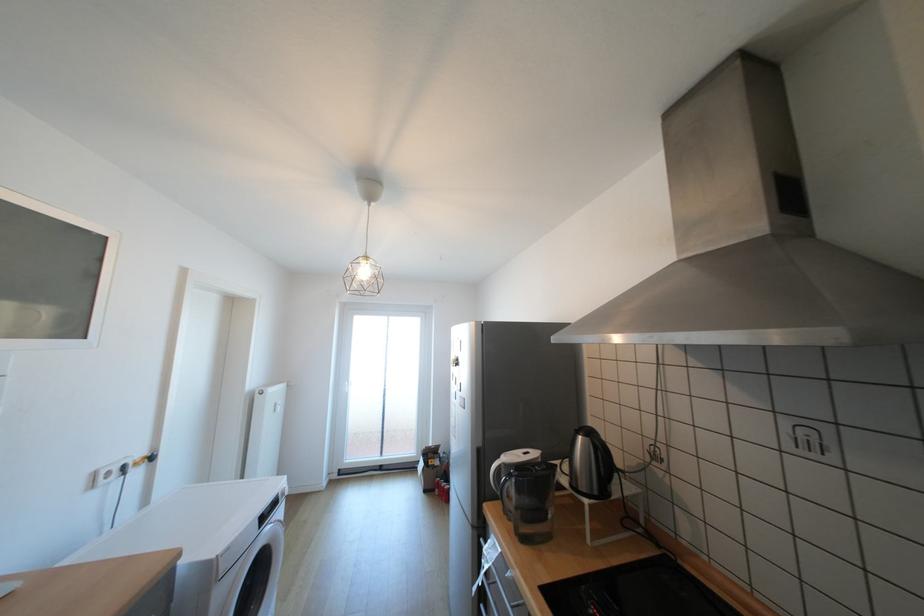
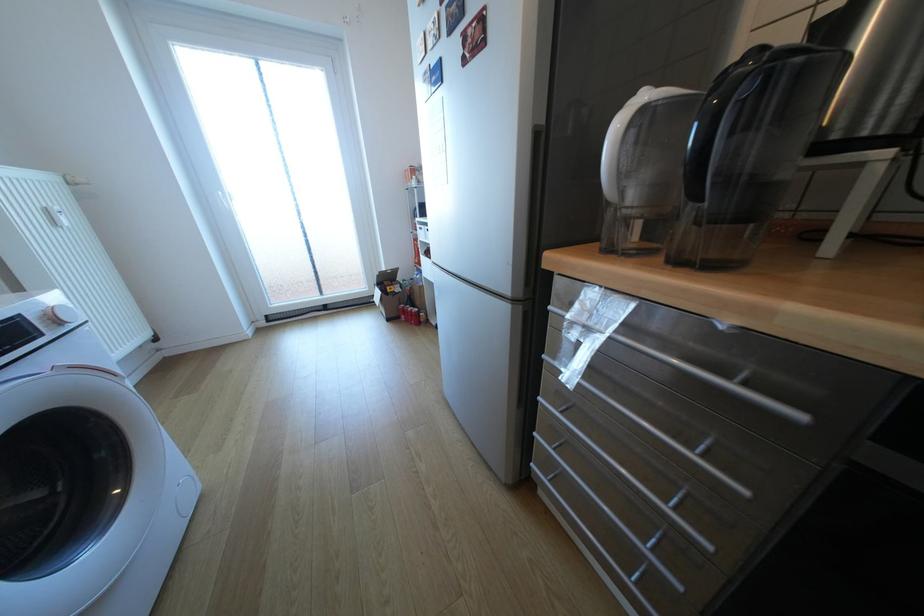
In the second image, find the point that corresponds to the point at 439,461 in the first image.

(397, 288)